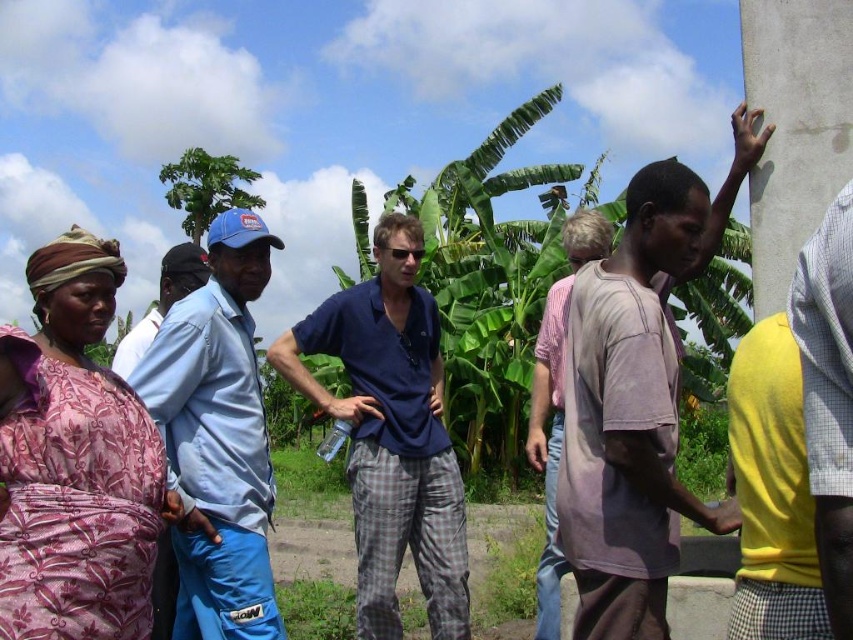
Which is above, blue cotton shirt at center or light blue shirt at left?

light blue shirt at left

Who is more forward, [287,337] or [206,403]?

Point [206,403]

What do you see at coordinates (392, 433) in the screenshot?
I see `blue cotton shirt at center` at bounding box center [392, 433].

In order to click on blue cotton shirt at center in this screenshot , I will do `click(392, 433)`.

Between blue cotton shirt at center and gray concrete pillar at right, which one appears on the left side from the viewer's perspective?

blue cotton shirt at center is more to the left.

Is blue cotton shirt at center bigger than gray concrete pillar at right?

Correct, blue cotton shirt at center is larger in size than gray concrete pillar at right.

What do you see at coordinates (392, 433) in the screenshot?
I see `blue cotton shirt at center` at bounding box center [392, 433].

The height and width of the screenshot is (640, 853). Find the location of `blue cotton shirt at center`. blue cotton shirt at center is located at coordinates (392, 433).

Between point (639, 358) and point (202, 545), which one is positioned in front?

Point (639, 358) is in front.

Does point (625, 305) lie in front of point (175, 476)?

Yes, it is.

Where is `light brown cotton shirt at right`? The width and height of the screenshot is (853, 640). light brown cotton shirt at right is located at coordinates (637, 397).